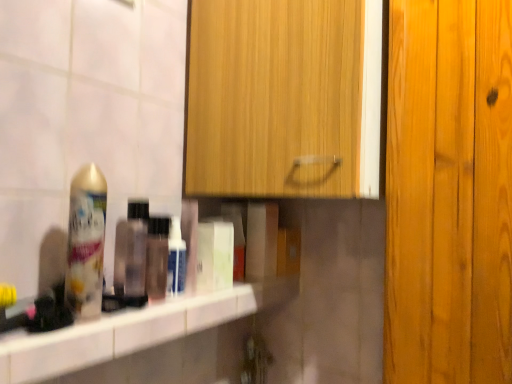
Question: Can you confirm if translucent plastic bottle at shelf, the first mouthwash in the left-to-right sequence, is wider than white glossy bottle at center, the 1th mouthwash from the right?

Choices:
 (A) no
 (B) yes

Answer: (B)

Question: Can you confirm if translucent plastic bottle at shelf, marked as the 2th mouthwash in a right-to-left arrangement, is thinner than white glossy bottle at center, arranged as the 2th mouthwash when viewed from the left?

Choices:
 (A) yes
 (B) no

Answer: (B)

Question: Does translucent plastic bottle at shelf, marked as the 2th mouthwash in a right-to-left arrangement, appear on the left side of white glossy bottle at center, arranged as the 2th mouthwash when viewed from the left?

Choices:
 (A) no
 (B) yes

Answer: (B)

Question: From the image's perspective, is translucent plastic bottle at shelf, the first mouthwash in the left-to-right sequence, over white glossy bottle at center, the 1th mouthwash from the right?

Choices:
 (A) yes
 (B) no

Answer: (A)

Question: Can you confirm if translucent plastic bottle at shelf, marked as the 2th mouthwash in a right-to-left arrangement, is taller than white glossy bottle at center, arranged as the 2th mouthwash when viewed from the left?

Choices:
 (A) yes
 (B) no

Answer: (A)

Question: Does translucent plastic bottle at shelf, marked as the 2th mouthwash in a right-to-left arrangement, have a larger size compared to white glossy bottle at center, arranged as the 2th mouthwash when viewed from the left?

Choices:
 (A) yes
 (B) no

Answer: (A)

Question: From the image's perspective, is translucent plastic bottle at center beneath gold metallic can at left?

Choices:
 (A) no
 (B) yes

Answer: (B)

Question: Is gold metallic can at left a part of translucent plastic bottle at center?

Choices:
 (A) no
 (B) yes

Answer: (A)

Question: Is translucent plastic bottle at center facing away from gold metallic can at left?

Choices:
 (A) yes
 (B) no

Answer: (B)

Question: Is translucent plastic bottle at center to the right of gold metallic can at left from the viewer's perspective?

Choices:
 (A) no
 (B) yes

Answer: (B)

Question: Is translucent plastic bottle at center completely or partially outside of gold metallic can at left?

Choices:
 (A) no
 (B) yes

Answer: (B)

Question: From the image's perspective, is translucent plastic bottle at center over gold metallic can at left?

Choices:
 (A) yes
 (B) no

Answer: (B)

Question: Is white glossy bottle at center, arranged as the 2th mouthwash when viewed from the left, next to wooden cabinet at upper center and touching it?

Choices:
 (A) no
 (B) yes

Answer: (A)